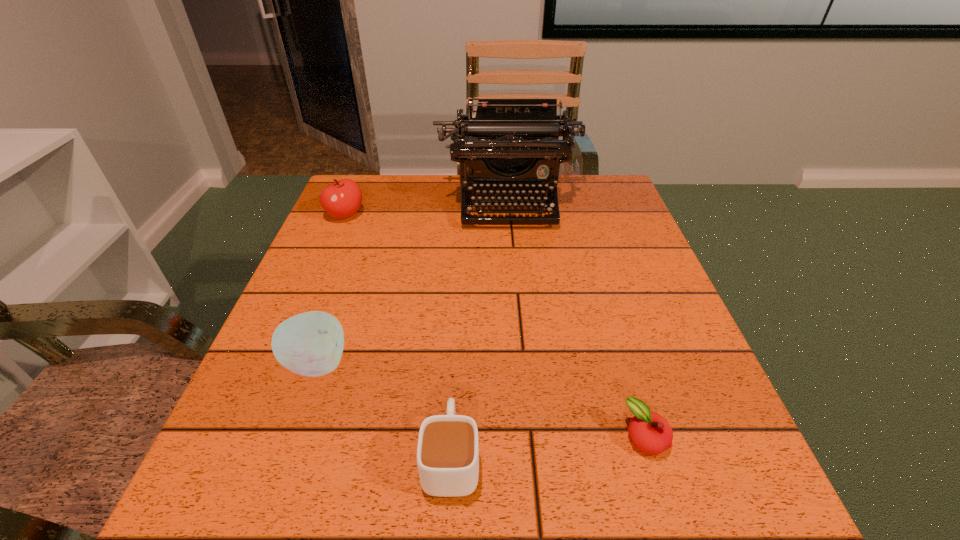
Find the location of a particular element. The height and width of the screenshot is (540, 960). free space located 0.200m on the side with the handle of the second shortest object is located at coordinates (458, 327).

What are the coordinates of `free space located on the side with the handle of the second shortest object` in the screenshot? It's located at (459, 296).

Identify the location of vacant region located on the left of the shortest object. This screenshot has width=960, height=540. pos(431,437).

You are a GUI agent. You are given a task and a screenshot of the screen. Output one action in this format:
    pyautogui.click(x=<x>, y=<y>)
    Task: Click on the typewriter located at the far edge
    This screenshot has width=960, height=540.
    Given the screenshot: What is the action you would take?
    pyautogui.click(x=510, y=144)

Where is `apple present at the far edge`? apple present at the far edge is located at coordinates (342, 199).

Locate an element on the screen. The width and height of the screenshot is (960, 540). object located in the near edge section of the desktop is located at coordinates (448, 445).

Where is `typewriter present at the right edge`? This screenshot has width=960, height=540. typewriter present at the right edge is located at coordinates (510, 144).

The height and width of the screenshot is (540, 960). What are the coordinates of `apple positioned at the right edge` in the screenshot? It's located at (651, 433).

The height and width of the screenshot is (540, 960). Identify the location of object situated at the far left corner. (342, 199).

Find the location of `object present at the far right corner`. object present at the far right corner is located at coordinates (510, 144).